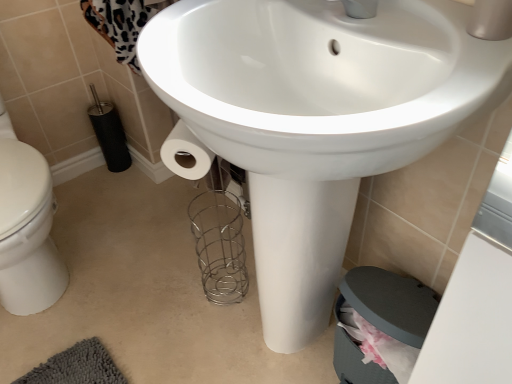
Describe the element at coordinates (316, 118) in the screenshot. Image resolution: width=512 pixels, height=384 pixels. I see `white glossy sink at center` at that location.

Where is `white glossy sink at center`? The width and height of the screenshot is (512, 384). white glossy sink at center is located at coordinates (316, 118).

You are a GUI agent. You are given a task and a screenshot of the screen. Output one action in this format:
    pyautogui.click(x=<x>, y=<y>)
    Task: Click on the white glossy sink at center
    
    Given the screenshot: What is the action you would take?
    click(316, 118)